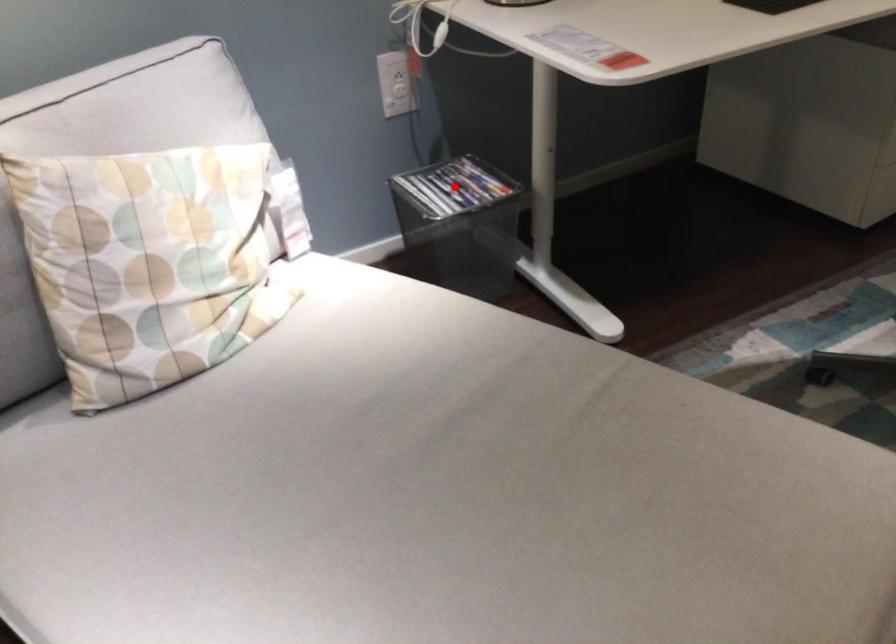
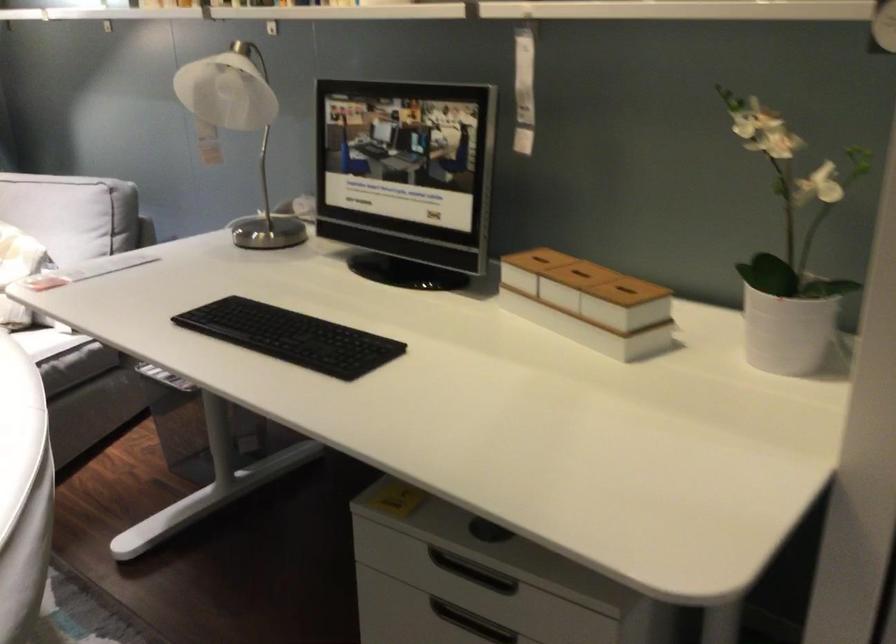
Question: I am providing you with two images of the same scene from different viewpoints. A red point is marked on the first image. At the location where the point appears in image 1, is it still visible in image 2?

Choices:
 (A) Yes
 (B) No

Answer: (B)